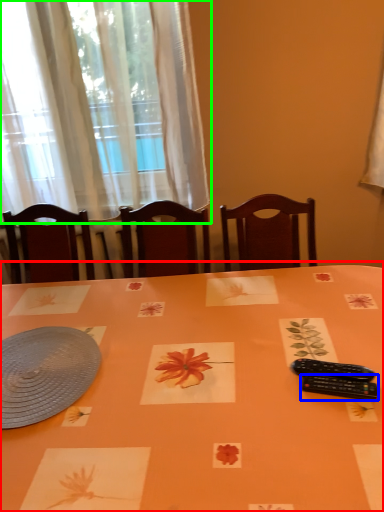
Question: Based on their relative distances, which object is farther from table (highlighted by a red box)? Choose from control (highlighted by a blue box) and curtain (highlighted by a green box).

Choices:
 (A) control
 (B) curtain

Answer: (B)